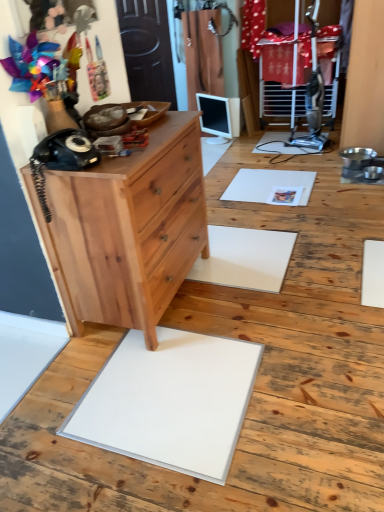
Question: Which is correct: black matte rotary phone at left is inside natural wood dresser at left, or outside of it?

Choices:
 (A) inside
 (B) outside

Answer: (B)

Question: Considering the positions of black matte rotary phone at left and natural wood dresser at left in the image, is black matte rotary phone at left bigger or smaller than natural wood dresser at left?

Choices:
 (A) big
 (B) small

Answer: (B)

Question: Which object is the closest to the natural wood dresser at left?

Choices:
 (A) black matte rotary phone at left
 (B) natural wood chest of drawers at left

Answer: (B)

Question: Which is nearer to the black matte rotary phone at left?

Choices:
 (A) natural wood dresser at left
 (B) natural wood chest of drawers at left

Answer: (B)